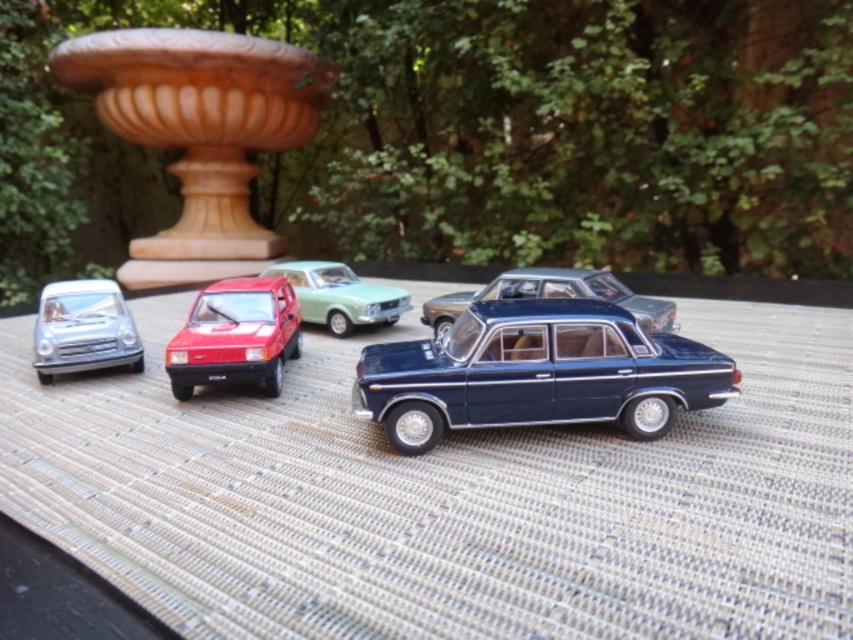
Does glossy blue sedan at center have a greater width compared to light green glossy car at center?

Yes.

Can you confirm if glossy blue sedan at center is positioned to the right of light green glossy car at center?

Correct, you'll find glossy blue sedan at center to the right of light green glossy car at center.

What do you see at coordinates (552, 296) in the screenshot?
I see `glossy blue sedan at center` at bounding box center [552, 296].

Identify the location of glossy blue sedan at center. (552, 296).

Does point (410, 346) come farther from viewer compared to point (187, 342)?

No, (410, 346) is closer to viewer.

Is point (561, 364) positioned behind point (180, 372)?

No.

Find the location of a particular element. This screenshot has height=640, width=853. shiny blue sedan at center is located at coordinates (537, 372).

Consider the image. Is shiny blue sedan at center bigger than shiny silver car at left?

Correct, shiny blue sedan at center is larger in size than shiny silver car at left.

Can you confirm if shiny blue sedan at center is positioned to the right of shiny silver car at left?

Yes, shiny blue sedan at center is to the right of shiny silver car at left.

Locate an element on the screen. The image size is (853, 640). shiny blue sedan at center is located at coordinates (537, 372).

The height and width of the screenshot is (640, 853). I want to click on shiny blue sedan at center, so click(x=537, y=372).